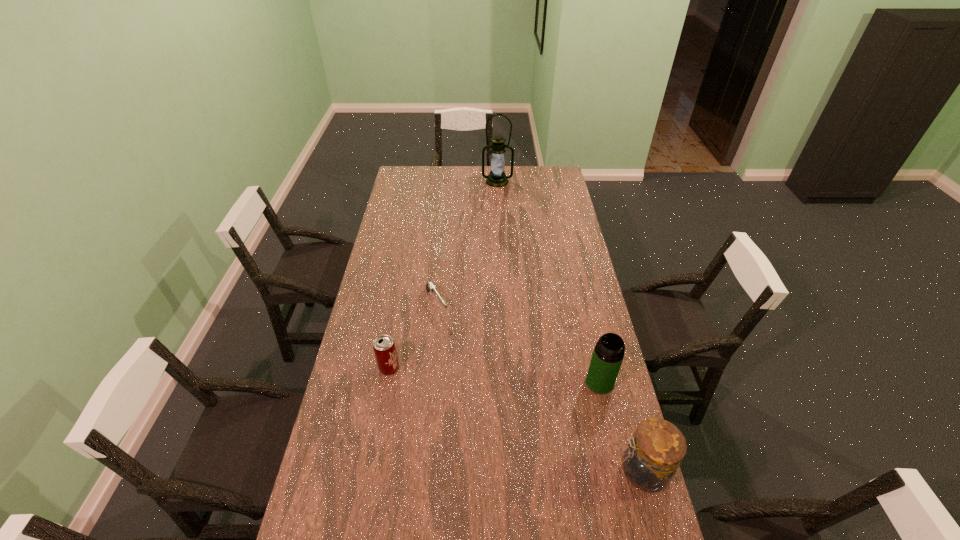
Find the location of a particular element. vacant space that's between the thermos bottle and the second shortest object is located at coordinates (494, 375).

I want to click on the fourth closest object relative to the nearest object, so click(x=497, y=178).

Identify which object is the third closest to the lantern. Please provide its 2D coordinates. Your answer should be formatted as a tuple, i.e. [(x, y)], where the tuple contains the x and y coordinates of a point satisfying the conditions above.

[(608, 354)]

Where is `blank space that satisfies the following two spatial constraints: 1. on the front side of the farthest object; 2. on the left side of the thermos bottle`? This screenshot has height=540, width=960. blank space that satisfies the following two spatial constraints: 1. on the front side of the farthest object; 2. on the left side of the thermos bottle is located at coordinates (508, 382).

The height and width of the screenshot is (540, 960). Find the location of `free spot that satisfies the following two spatial constraints: 1. on the back side of the pistol; 2. on the left side of the farthest object`. free spot that satisfies the following two spatial constraints: 1. on the back side of the pistol; 2. on the left side of the farthest object is located at coordinates (448, 181).

The width and height of the screenshot is (960, 540). I want to click on free space that satisfies the following two spatial constraints: 1. on the front side of the beer can; 2. on the left side of the second tallest object, so click(387, 382).

Locate an element on the screen. free space that satisfies the following two spatial constraints: 1. on the front side of the jar; 2. on the lid of the lantern is located at coordinates (513, 471).